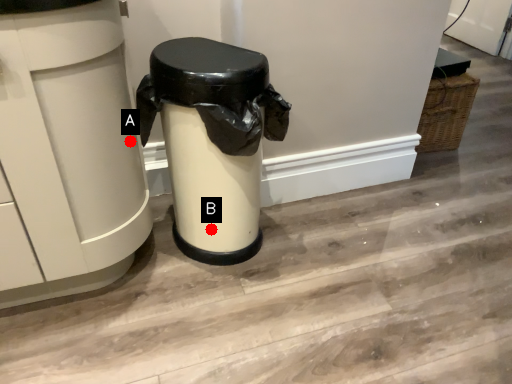
Question: Two points are circled on the image, labeled by A and B beside each circle. Which point is farther to the camera?

Choices:
 (A) A is further
 (B) B is further

Answer: (B)